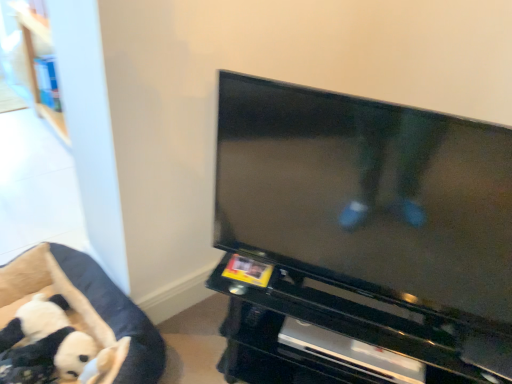
This screenshot has width=512, height=384. What do you see at coordinates (90, 305) in the screenshot? I see `soft plush dog bed at lower left` at bounding box center [90, 305].

The image size is (512, 384). Describe the element at coordinates (54, 336) in the screenshot. I see `black plush toy at lower left` at that location.

Where is `black glossy entertainment center at center`? black glossy entertainment center at center is located at coordinates [x=358, y=326].

Is soft plush dog bed at lower left looking in the opposite direction of black glossy tv at center?

No, soft plush dog bed at lower left is not facing the opposite direction of black glossy tv at center.

Does soft plush dog bed at lower left contain black glossy tv at center?

No, black glossy tv at center is not a part of soft plush dog bed at lower left.

Between soft plush dog bed at lower left and black glossy tv at center, which one has less height?

soft plush dog bed at lower left.

Can you tell me how much soft plush dog bed at lower left and black glossy tv at center differ in facing direction?

23.1 degrees separate the facing orientations of soft plush dog bed at lower left and black glossy tv at center.

This screenshot has width=512, height=384. What are the coordinates of `furniture below the black glossy tv at center (from a real-world perspective)` in the screenshot? It's located at (90, 305).

Consider the image. Is black glossy tv at center positioned with its back to soft plush dog bed at lower left?

black glossy tv at center does not have its back to soft plush dog bed at lower left.

What's the angular difference between black glossy tv at center and soft plush dog bed at lower left's facing directions?

The angle between the facing direction of black glossy tv at center and the facing direction of soft plush dog bed at lower left is 23.1 degrees.

Considering the relative sizes of black glossy tv at center and soft plush dog bed at lower left in the image provided, is black glossy tv at center thinner than soft plush dog bed at lower left?

Yes.

Is black glossy entertainment center at center looking in the opposite direction of soft plush dog bed at lower left?

No, black glossy entertainment center at center's orientation is not away from soft plush dog bed at lower left.

From the image's perspective, is black glossy entertainment center at center on soft plush dog bed at lower left?

Yes.

Is black glossy entertainment center at center bigger than soft plush dog bed at lower left?

Yes, black glossy entertainment center at center is bigger than soft plush dog bed at lower left.

Considering the relative sizes of black glossy entertainment center at center and soft plush dog bed at lower left in the image provided, is black glossy entertainment center at center thinner than soft plush dog bed at lower left?

No, black glossy entertainment center at center is not thinner than soft plush dog bed at lower left.

Is black plush toy at lower left looking in the opposite direction of black glossy tv at center?

That's not correct — black plush toy at lower left is not looking away from black glossy tv at center.

Could black glossy tv at center be considered to be inside black plush toy at lower left?

No, black glossy tv at center is not inside black plush toy at lower left.

Where is `toy below the black glossy tv at center (from a real-world perspective)`? toy below the black glossy tv at center (from a real-world perspective) is located at coordinates point(54,336).

Considering the relative sizes of black plush toy at lower left and black glossy tv at center in the image provided, is black plush toy at lower left smaller than black glossy tv at center?

Indeed, black plush toy at lower left has a smaller size compared to black glossy tv at center.

Is black plush toy at lower left not inside black glossy entertainment center at center?

Yes, black plush toy at lower left is outside of black glossy entertainment center at center.

In terms of height, does black plush toy at lower left look taller or shorter compared to black glossy entertainment center at center?

black plush toy at lower left is shorter than black glossy entertainment center at center.

Considering the sizes of objects black plush toy at lower left and black glossy entertainment center at center in the image provided, who is thinner, black plush toy at lower left or black glossy entertainment center at center?

With smaller width is black plush toy at lower left.

Which is more to the left, black plush toy at lower left or black glossy entertainment center at center?

From the viewer's perspective, black plush toy at lower left appears more on the left side.

Considering the positions of objects black glossy entertainment center at center and black glossy tv at center in the image provided, who is in front, black glossy entertainment center at center or black glossy tv at center?

black glossy tv at center is closer to the camera.

Can you confirm if black glossy entertainment center at center is smaller than black glossy tv at center?

Actually, black glossy entertainment center at center might be larger than black glossy tv at center.

Measure the distance between black glossy entertainment center at center and black glossy tv at center.

black glossy entertainment center at center is 9.98 inches from black glossy tv at center.

Is black glossy entertainment center at center far from black glossy tv at center?

No, black glossy entertainment center at center is not far away from black glossy tv at center.

Are black glossy entertainment center at center and black plush toy at lower left far apart?

No, black glossy entertainment center at center is in close proximity to black plush toy at lower left.

Does black glossy entertainment center at center have a smaller size compared to black plush toy at lower left?

Result: No, black glossy entertainment center at center is not smaller than black plush toy at lower left.

I want to click on entertainment center above the black plush toy at lower left (from the image's perspective), so click(358, 326).

From the image's perspective, is black glossy entertainment center at center above or below black plush toy at lower left?

black glossy entertainment center at center is above black plush toy at lower left.

You are a GUI agent. You are given a task and a screenshot of the screen. Output one action in this format:
    pyautogui.click(x=<x>, y=<y>)
    Task: Click on the furniture that is on the left side of black glossy tv at center
    This screenshot has height=384, width=512.
    Given the screenshot: What is the action you would take?
    pyautogui.click(x=90, y=305)

Where is `television lying on the right of soft plush dog bed at lower left`? The image size is (512, 384). television lying on the right of soft plush dog bed at lower left is located at coordinates (368, 197).

Which object lies nearer to the anchor point soft plush dog bed at lower left, black glossy tv at center or black plush toy at lower left?

Based on the image, black plush toy at lower left appears to be nearer to soft plush dog bed at lower left.

When comparing their distances from black glossy entertainment center at center, does black glossy tv at center or black plush toy at lower left seem closer?

black glossy tv at center is positioned closer to the anchor black glossy entertainment center at center.

Considering their positions, is black glossy tv at center positioned closer to black plush toy at lower left than soft plush dog bed at lower left?

soft plush dog bed at lower left is positioned closer to the anchor black plush toy at lower left.

From the image, which object appears to be nearer to black glossy tv at center, black plush toy at lower left or black glossy entertainment center at center?

black glossy entertainment center at center lies closer to black glossy tv at center than the other object.

Estimate the real-world distances between objects in this image. Which object is closer to black plush toy at lower left, black glossy entertainment center at center or black glossy tv at center?

black glossy entertainment center at center is closer to black plush toy at lower left.

From the image, which object appears to be nearer to black glossy tv at center, black plush toy at lower left or soft plush dog bed at lower left?

Based on the image, soft plush dog bed at lower left appears to be nearer to black glossy tv at center.

Considering their positions, is black glossy entertainment center at center positioned further to soft plush dog bed at lower left than black glossy tv at center?

The object further to soft plush dog bed at lower left is black glossy tv at center.

When comparing their distances from black glossy tv at center, does black glossy entertainment center at center or black plush toy at lower left seem further?

black plush toy at lower left.

You are a GUI agent. You are given a task and a screenshot of the screen. Output one action in this format:
    pyautogui.click(x=<x>, y=<y>)
    Task: Click on the television located between soft plush dog bed at lower left and black glossy entertainment center at center in the left-right direction
    This screenshot has width=512, height=384.
    Given the screenshot: What is the action you would take?
    pyautogui.click(x=368, y=197)

This screenshot has height=384, width=512. Find the location of `television between black plush toy at lower left and black glossy entertainment center at center from left to right`. television between black plush toy at lower left and black glossy entertainment center at center from left to right is located at coordinates (368, 197).

This screenshot has width=512, height=384. I want to click on furniture between black plush toy at lower left and black glossy entertainment center at center from left to right, so click(90, 305).

Where is `furniture between black plush toy at lower left and black glossy tv at center`? furniture between black plush toy at lower left and black glossy tv at center is located at coordinates (90, 305).